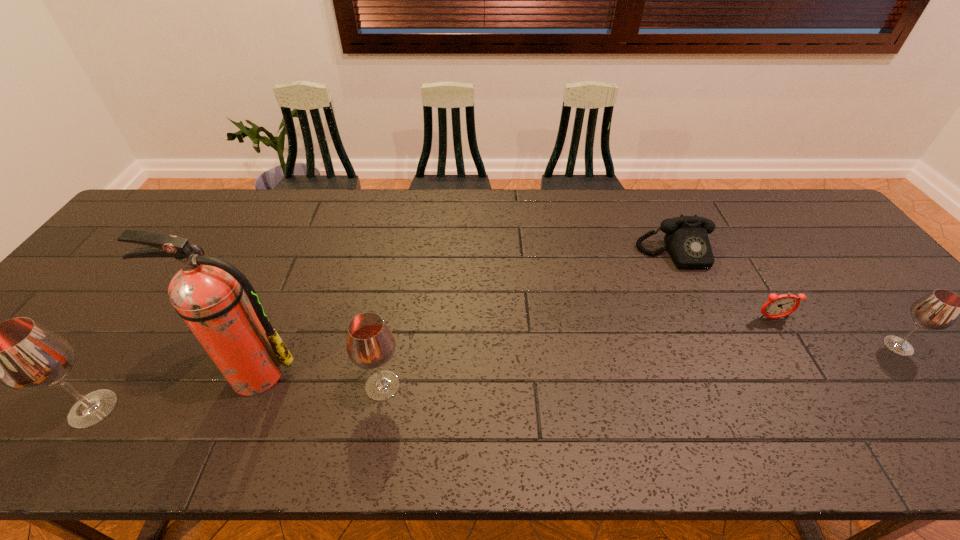
Where is `the second object from right to left`? This screenshot has width=960, height=540. the second object from right to left is located at coordinates coord(779,306).

Where is `alarm clock`? This screenshot has width=960, height=540. alarm clock is located at coordinates (779, 306).

This screenshot has height=540, width=960. In order to click on free space located on the right of the leftmost wineglass in this screenshot , I will do `click(265, 408)`.

Image resolution: width=960 pixels, height=540 pixels. I want to click on vacant space located on the right of the second wineglass from right to left, so click(x=440, y=386).

This screenshot has height=540, width=960. I want to click on vacant position located 0.250m on the back of the shortest wineglass, so click(830, 264).

Where is `vacant space located on the dial of the telephone`? vacant space located on the dial of the telephone is located at coordinates (702, 310).

Locate an element on the screen. This screenshot has height=540, width=960. vacant region located on the front-facing side of the alarm clock is located at coordinates (807, 376).

Locate an element on the screen. The image size is (960, 540). fire extinguisher present at the near edge is located at coordinates (207, 292).

Where is `object that is at the right edge`? object that is at the right edge is located at coordinates (938, 310).

What are the coordinates of `vacant space at the far edge of the desktop` in the screenshot? It's located at (260, 216).